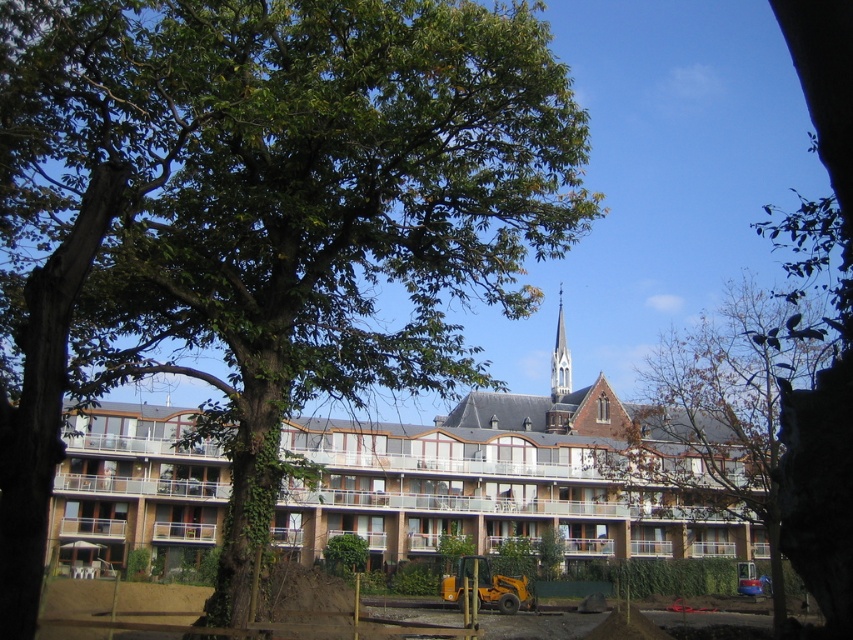
At what (x,y) coordinates should I click in order to perform the action: click on green leafy tree at center. Please return your answer as a coordinate pair (x, y). Image resolution: width=853 pixels, height=640 pixels. Looking at the image, I should click on (259, 218).

Can you confirm if green leafy tree at center is positioned below brown leafy tree at center?

No, green leafy tree at center is not below brown leafy tree at center.

Which is in front, point (322, 253) or point (764, 353)?

Point (322, 253) is in front.

Where is `green leafy tree at center`? green leafy tree at center is located at coordinates (259, 218).

Who is lower down, brown brick building at center or brown leafy tree at center?

Positioned lower is brown brick building at center.

Is point (184, 508) farther from viewer compared to point (793, 314)?

No.

Identify the location of brown brick building at center. (508, 483).

Is brown brick building at center thinner than smooth white steeple at upper center?

Incorrect, brown brick building at center's width is not less than smooth white steeple at upper center's.

In the scene shown: Can you confirm if brown brick building at center is positioned to the left of smooth white steeple at upper center?

Indeed, brown brick building at center is positioned on the left side of smooth white steeple at upper center.

At what (x,y) coordinates should I click in order to perform the action: click on brown brick building at center. Please return your answer as a coordinate pair (x, y). Looking at the image, I should click on (508, 483).

Where is `brown brick building at center`? brown brick building at center is located at coordinates (508, 483).